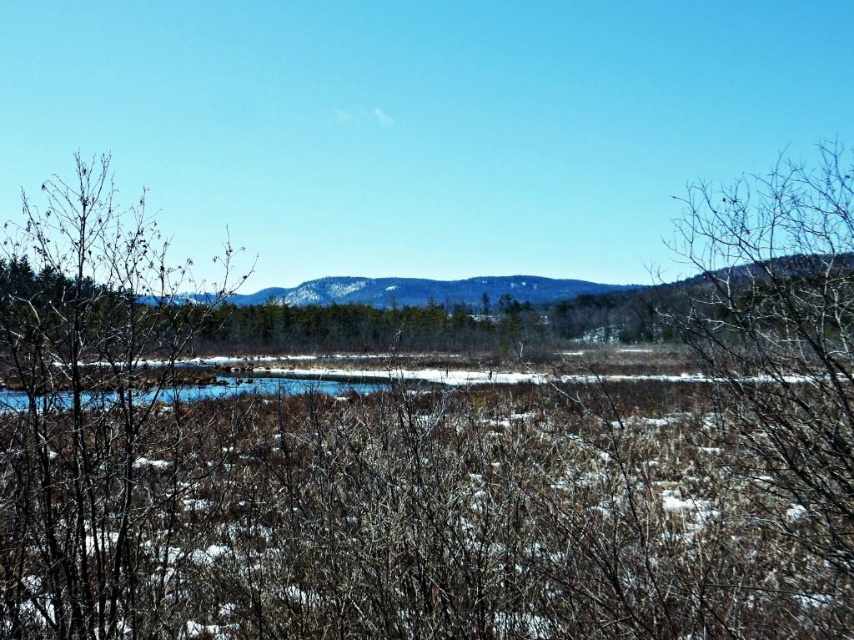
You are an artist trying to paint this winter scene. You want to ensure the bare branches at left and brown textured branches at right are proportionate. Based on the scene, which branches are wider?

The bare branches at left are wider than the brown textured branches at right.

You are standing in the winter landscape and want to take a photo of the bare branches at left. Where should you position yourself to capture them in the frame?

The bare branches at left are located at point [89,412], so you should position yourself to the left side of the scene to ensure they are centered in your photo.

You are standing in the winter landscape and want to take a photo of the bare branches at left and brown textured branches at right. Which branches are closer to the camera?

The bare branches at left are closer to the camera because they are positioned below the brown textured branches at right, indicating they are in the foreground.